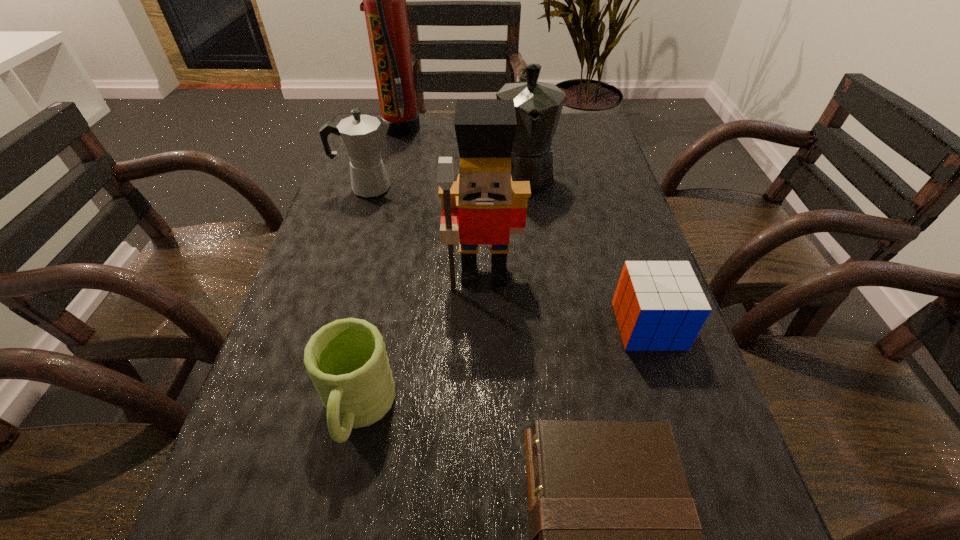
At what (x,y) coordinates should I click in order to perform the action: click on free space between the second tallest object and the fifth farthest object. Please return your answer as a coordinate pair (x, y). The width and height of the screenshot is (960, 540). Looking at the image, I should click on tap(566, 300).

Identify the location of the closest object to the shorter coffeepot. This screenshot has height=540, width=960. (384, 0).

Locate which object is the third closest to the nutcracker. Please provide its 2D coordinates. Your answer should be formatted as a tuple, i.e. [(x, y)], where the tuple contains the x and y coordinates of a point satisfying the conditions above.

[(538, 105)]

You are a GUI agent. You are given a task and a screenshot of the screen. Output one action in this format:
    pyautogui.click(x=<x>, y=<y>)
    Task: Click on the vacant space that satisfies the following two spatial constraints: 1. in front of the third nearest object holding the staff; 2. on the right side of the nutcracker
    The image size is (960, 540).
    Given the screenshot: What is the action you would take?
    pyautogui.click(x=485, y=326)

At what (x,y) coordinates should I click in order to perform the action: click on blank area in the image that satisfies the following two spatial constraints: 1. on the front side of the sixth tallest object; 2. on the right side of the left coffeepot. Please return your answer as a coordinate pair (x, y). The width and height of the screenshot is (960, 540). Looking at the image, I should click on (325, 326).

Where is `free spot that satisfies the following two spatial constraints: 1. with the nozzle pointing from the back of the fire extinguisher; 2. on the left side of the sixth tallest object`? free spot that satisfies the following two spatial constraints: 1. with the nozzle pointing from the back of the fire extinguisher; 2. on the left side of the sixth tallest object is located at coordinates (349, 326).